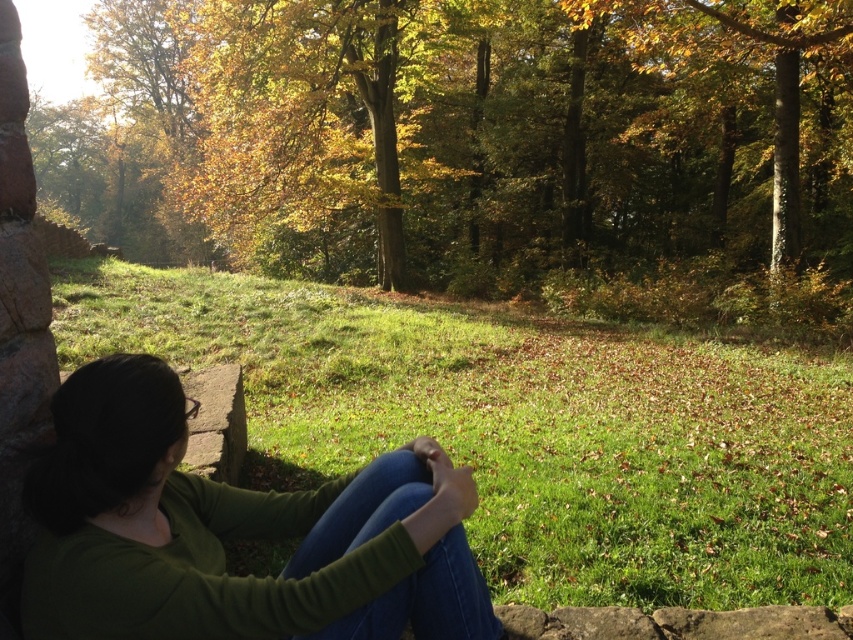
Question: Is green matte shirt at center bigger than gray concrete stone at left?

Choices:
 (A) yes
 (B) no

Answer: (B)

Question: Which point appears farthest from the camera in this image?

Choices:
 (A) (238, 381)
 (B) (816, 3)

Answer: (B)

Question: In this image, where is green leafy tree at upper left located relative to golden leafy tree at center?

Choices:
 (A) left
 (B) right

Answer: (A)

Question: Which object is farther from the camera taking this photo?

Choices:
 (A) gray concrete stone at left
 (B) golden leafy tree at center
 (C) green leafy tree at upper left

Answer: (C)

Question: Which point is closer to the camera taking this photo?

Choices:
 (A) (741, 74)
 (B) (193, 451)
 (C) (769, 86)

Answer: (B)

Question: Is green matte shirt at center below golden leafy tree at center?

Choices:
 (A) no
 (B) yes

Answer: (B)